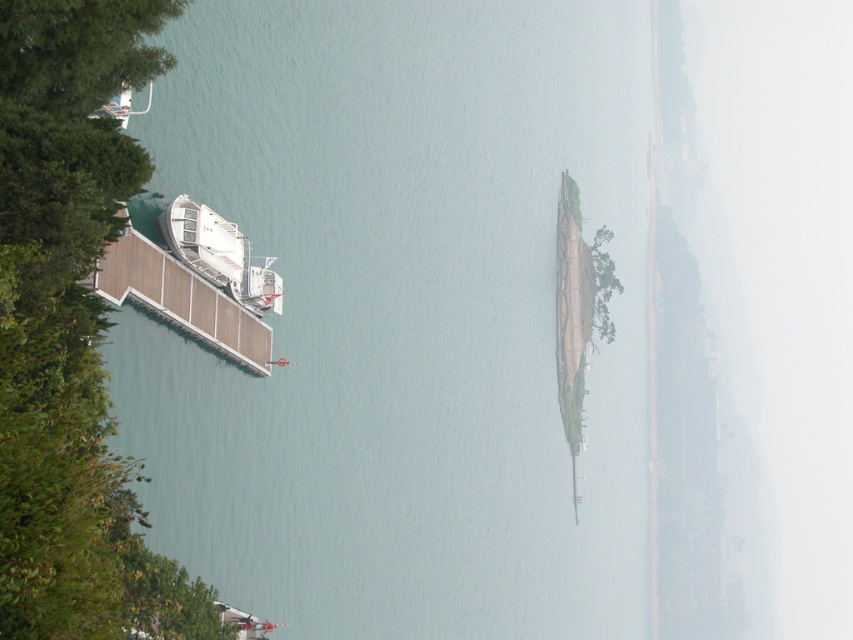
Question: Can you confirm if white glossy boat at left is wider than white glossy boat at upper left?

Choices:
 (A) no
 (B) yes

Answer: (A)

Question: Can you confirm if wooden dock at left is bigger than white glossy boat at left?

Choices:
 (A) yes
 (B) no

Answer: (A)

Question: Is white glossy boat at left to the right of white glossy boat at upper left from the viewer's perspective?

Choices:
 (A) no
 (B) yes

Answer: (B)

Question: Which of the following is the closest to the observer?

Choices:
 (A) white glossy boat at upper left
 (B) white glossy boat at left

Answer: (A)

Question: Which point appears farthest from the camera in this image?

Choices:
 (A) (125, 278)
 (B) (73, 582)
 (C) (114, 109)
 (D) (268, 308)

Answer: (D)

Question: Which point is closer to the camera?

Choices:
 (A) white glossy boat at upper left
 (B) green leafy tree at left
 (C) wooden dock at left

Answer: (B)